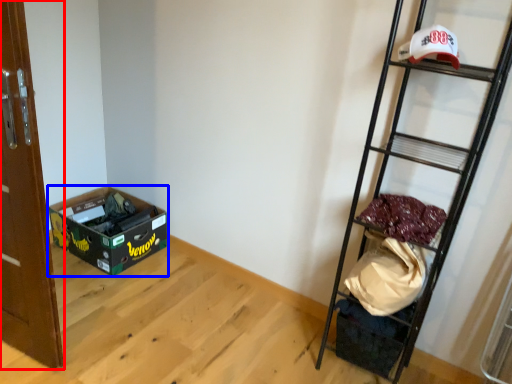
Question: Among these objects, which one is nearest to the camera, door (highlighted by a red box) or box (highlighted by a blue box)?

Choices:
 (A) door
 (B) box

Answer: (A)